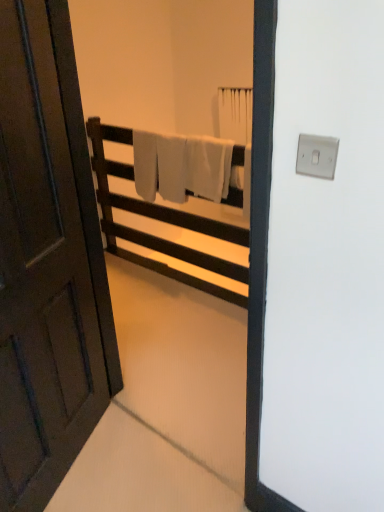
Question: Considering the relative positions of white soft towel at center and white matte towel rack at center in the image provided, is white soft towel at center to the left of white matte towel rack at center from the viewer's perspective?

Choices:
 (A) no
 (B) yes

Answer: (A)

Question: Is white soft towel at center oriented towards white matte towel rack at center?

Choices:
 (A) no
 (B) yes

Answer: (B)

Question: From the image's perspective, is white soft towel at center above white matte towel rack at center?

Choices:
 (A) no
 (B) yes

Answer: (B)

Question: Is white soft towel at center shorter than white matte towel rack at center?

Choices:
 (A) yes
 (B) no

Answer: (A)

Question: Considering the relative sizes of white soft towel at center and white matte towel rack at center in the image provided, is white soft towel at center bigger than white matte towel rack at center?

Choices:
 (A) yes
 (B) no

Answer: (B)

Question: From their relative heights in the image, would you say white matte towel rack at center is taller or shorter than dark wood door at left?

Choices:
 (A) tall
 (B) short

Answer: (B)

Question: In terms of size, does white matte towel rack at center appear bigger or smaller than dark wood door at left?

Choices:
 (A) big
 (B) small

Answer: (A)

Question: Is point (89, 119) closer or farther from the camera than point (23, 437)?

Choices:
 (A) closer
 (B) farther

Answer: (B)

Question: Would you say white matte towel rack at center is inside or outside dark wood door at left?

Choices:
 (A) inside
 (B) outside

Answer: (B)

Question: Considering the positions of dark wood door at left and white soft towel at center in the image, is dark wood door at left bigger or smaller than white soft towel at center?

Choices:
 (A) big
 (B) small

Answer: (A)

Question: In terms of height, does dark wood door at left look taller or shorter compared to white soft towel at center?

Choices:
 (A) tall
 (B) short

Answer: (A)

Question: Looking at their shapes, would you say dark wood door at left is wider or thinner than white soft towel at center?

Choices:
 (A) wide
 (B) thin

Answer: (A)

Question: From the image's perspective, is dark wood door at left above or below white soft towel at center?

Choices:
 (A) below
 (B) above

Answer: (A)

Question: Is white soft towel at center inside or outside of dark wood door at left?

Choices:
 (A) inside
 (B) outside

Answer: (B)

Question: From the image's perspective, relative to dark wood door at left, is white soft towel at center above or below?

Choices:
 (A) below
 (B) above

Answer: (B)